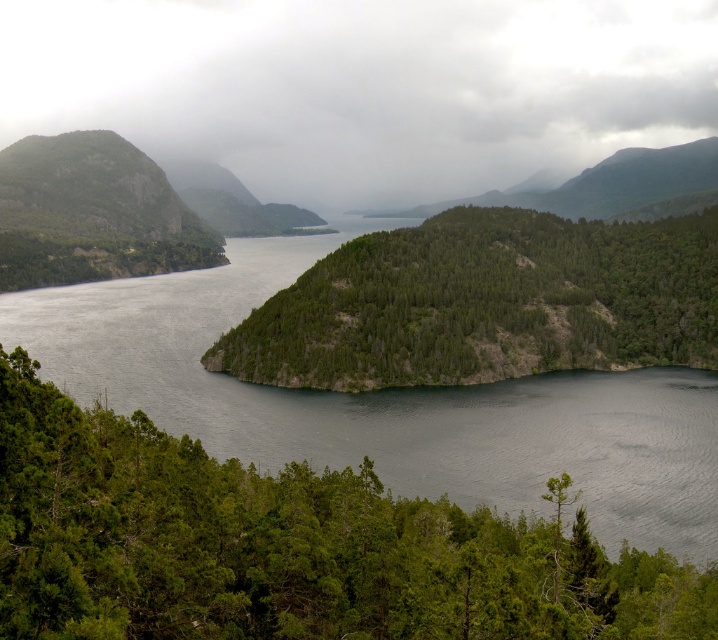
You are a bird soaring above the serene landscape. You notice a point marked at coordinates (363, 88). Which part of the scene does this point lie in?

The point marked at coordinates (363, 88) lies on the gray cloudy sky at upper center.

Consider the image. You are a hiker standing at the edge of the green forested mountain at upper center and want to reach the green matte tree at center. Which direction should you move to get there?

You should move downward towards the green matte tree at center because it is positioned under the green forested mountain at upper center.